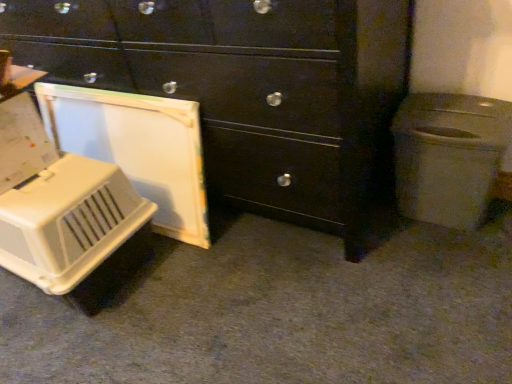
This screenshot has height=384, width=512. Describe the element at coordinates (68, 222) in the screenshot. I see `white plastic pet carrier at lower left` at that location.

This screenshot has width=512, height=384. What are the coordinates of `matte black chest of drawers at center` in the screenshot? It's located at [x=251, y=92].

Locate an element on the screen. This screenshot has height=384, width=512. white plastic pet carrier at lower left is located at coordinates (68, 222).

Consider the image. Which of these two, white plastic pet carrier at left or matte black chest of drawers at center, stands shorter?

With less height is white plastic pet carrier at left.

Between white plastic pet carrier at left and matte black chest of drawers at center, which one appears on the left side from the viewer's perspective?

Positioned to the left is matte black chest of drawers at center.

From the image's perspective, is white plastic pet carrier at left located above matte black chest of drawers at center?

No, from the image's perspective, white plastic pet carrier at left is not on top of matte black chest of drawers at center.

Between white plastic pet carrier at left and matte black chest of drawers at center, which one has larger width?

With larger width is white plastic pet carrier at left.

Considering the relative positions of white plastic pet carrier at lower left and white plastic pet carrier at left in the image provided, is white plastic pet carrier at lower left to the left of white plastic pet carrier at left from the viewer's perspective?

Yes, white plastic pet carrier at lower left is to the left of white plastic pet carrier at left.

Is point (64, 274) positioned in front of point (145, 369)?

No.

Is white plastic pet carrier at lower left bigger or smaller than white plastic pet carrier at left?

white plastic pet carrier at lower left is smaller than white plastic pet carrier at left.

Would you say matte black chest of drawers at center contains white plastic trash can at right?

No, white plastic trash can at right is not surrounded by matte black chest of drawers at center.

Is there a large distance between matte black chest of drawers at center and white plastic trash can at right?

No, matte black chest of drawers at center is in close proximity to white plastic trash can at right.

Based on their positions, is matte black chest of drawers at center located to the left or right of white plastic trash can at right?

From the image, it's evident that matte black chest of drawers at center is to the left of white plastic trash can at right.

How distant is matte black chest of drawers at center from white plastic pet carrier at left?

18.72 inches.

Which object is closer to the camera, matte black chest of drawers at center or white plastic pet carrier at left?

white plastic pet carrier at left is more forward.

From a real-world perspective, between matte black chest of drawers at center and white plastic pet carrier at left, who is vertically higher?

matte black chest of drawers at center, from a real-world perspective.

Where is `concrete in front of the matte black chest of drawers at center`? concrete in front of the matte black chest of drawers at center is located at coordinates (282, 313).

Is white plastic pet carrier at left bigger than white plastic trash can at right?

Yes, white plastic pet carrier at left is bigger than white plastic trash can at right.

Which is less distant, (100, 376) or (483, 135)?

Point (100, 376).

Which of these two, white plastic pet carrier at left or white plastic pet carrier at lower left, is wider?

white plastic pet carrier at left is wider.

Can you confirm if white plastic pet carrier at left is taller than white plastic pet carrier at lower left?

No.

Could you tell me if white plastic pet carrier at left is turned towards white plastic pet carrier at lower left?

No, white plastic pet carrier at left does not turn towards white plastic pet carrier at lower left.

From the image's perspective, would you say white plastic pet carrier at left is positioned over white plastic pet carrier at lower left?

No.

Relative to white plastic trash can at right, is white plastic pet carrier at lower left in front or behind?

white plastic pet carrier at lower left is positioned closer to the viewer than white plastic trash can at right.

From the image's perspective, is white plastic pet carrier at lower left beneath white plastic trash can at right?

Yes, from the image's perspective, white plastic pet carrier at lower left is below white plastic trash can at right.

Considering the positions of point (68, 167) and point (402, 120), is point (68, 167) closer or farther from the camera than point (402, 120)?

Point (68, 167) appears to be farther away from the viewer than point (402, 120).

From a real-world perspective, is white plastic pet carrier at lower left below white plastic trash can at right?

Yes, from a real-world perspective, white plastic pet carrier at lower left is under white plastic trash can at right.

Locate an element on the screen. The height and width of the screenshot is (384, 512). the chest of drawers behind the white plastic pet carrier at left is located at coordinates (251, 92).

Find the location of a particular element. This screenshot has height=384, width=512. appliance above the white plastic pet carrier at left (from a real-world perspective) is located at coordinates (68, 222).

Which object lies further to the anchor point white plastic pet carrier at lower left, white plastic pet carrier at left or white plastic trash can at right?

white plastic trash can at right is further to white plastic pet carrier at lower left.

Which object lies further to the anchor point white plastic pet carrier at left, white plastic trash can at right or matte black chest of drawers at center?

matte black chest of drawers at center is further to white plastic pet carrier at left.

From the image, which object appears to be farther from matte black chest of drawers at center, white plastic trash can at right or white plastic pet carrier at lower left?

Among the two, white plastic pet carrier at lower left is located further to matte black chest of drawers at center.

Considering their positions, is matte black chest of drawers at center positioned closer to white plastic pet carrier at lower left than white plastic trash can at right?

matte black chest of drawers at center lies closer to white plastic pet carrier at lower left than the other object.

Which object lies nearer to the anchor point matte black chest of drawers at center, white plastic pet carrier at left or white plastic pet carrier at lower left?

white plastic pet carrier at left is positioned closer to the anchor matte black chest of drawers at center.

Considering their positions, is matte black chest of drawers at center positioned further to white plastic pet carrier at left than white plastic pet carrier at lower left?

The object further to white plastic pet carrier at left is matte black chest of drawers at center.

When comparing their distances from white plastic trash can at right, does white plastic pet carrier at lower left or matte black chest of drawers at center seem closer?

matte black chest of drawers at center.

Considering their positions, is white plastic trash can at right positioned further to white plastic pet carrier at left than white plastic pet carrier at lower left?

Based on the image, white plastic pet carrier at lower left appears to be further to white plastic pet carrier at left.

The image size is (512, 384). Find the location of `appliance between matte black chest of drawers at center and white plastic pet carrier at left vertically`. appliance between matte black chest of drawers at center and white plastic pet carrier at left vertically is located at coordinates (68, 222).

Locate an element on the screen. The image size is (512, 384). concrete between white plastic pet carrier at lower left and white plastic trash can at right from left to right is located at coordinates (282, 313).

The height and width of the screenshot is (384, 512). Identify the location of chest of drawers between white plastic pet carrier at lower left and white plastic trash can at right in the horizontal direction. (251, 92).

In order to click on concrete located between matte black chest of drawers at center and white plastic trash can at right in the left-right direction in this screenshot , I will do coord(282,313).